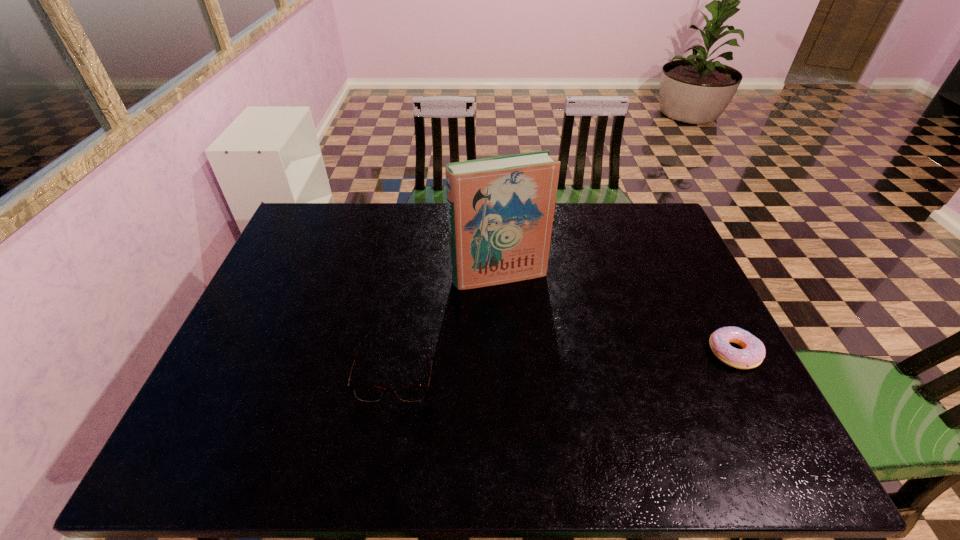
Identify the location of free space between the shortest object and the second tallest object. Image resolution: width=960 pixels, height=540 pixels. (565, 360).

The height and width of the screenshot is (540, 960). Find the location of `unoccupied area between the hardback book and the leftmost object`. unoccupied area between the hardback book and the leftmost object is located at coordinates (448, 322).

Locate an element on the screen. This screenshot has height=540, width=960. the closest object to the tallest object is located at coordinates (371, 393).

What are the coordinates of `the closest object to the leftmost object` in the screenshot? It's located at (500, 209).

Identify the location of vacant region that satisfies the following two spatial constraints: 1. on the front side of the second object from right to left; 2. on the right side of the shortest object. point(503,353).